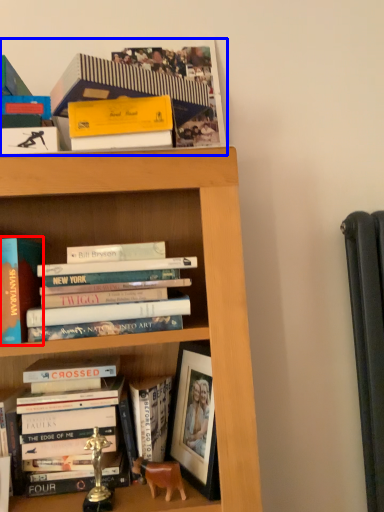
Question: Which object appears farthest to the camera in this image, book (highlighted by a red box) or book (highlighted by a blue box)?

Choices:
 (A) book
 (B) book

Answer: (A)